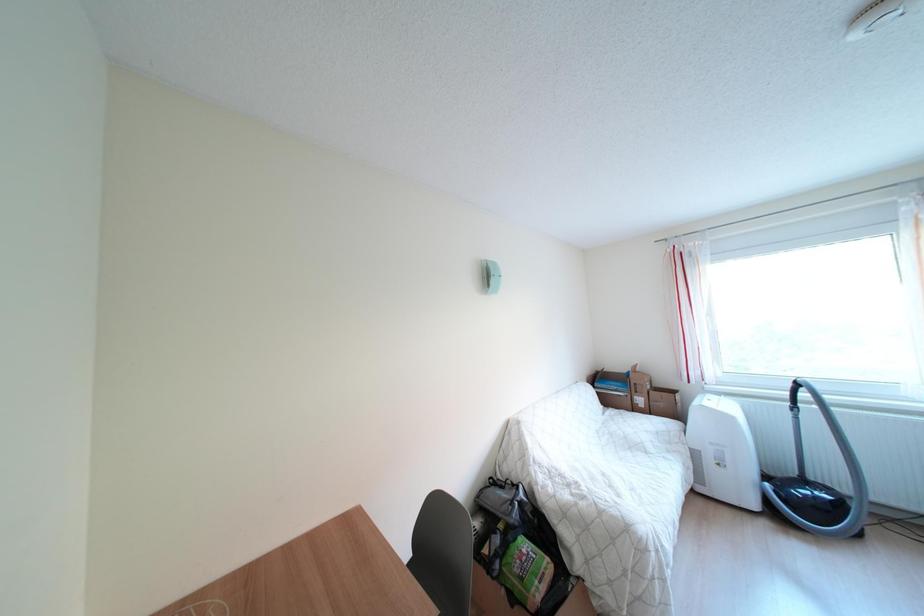
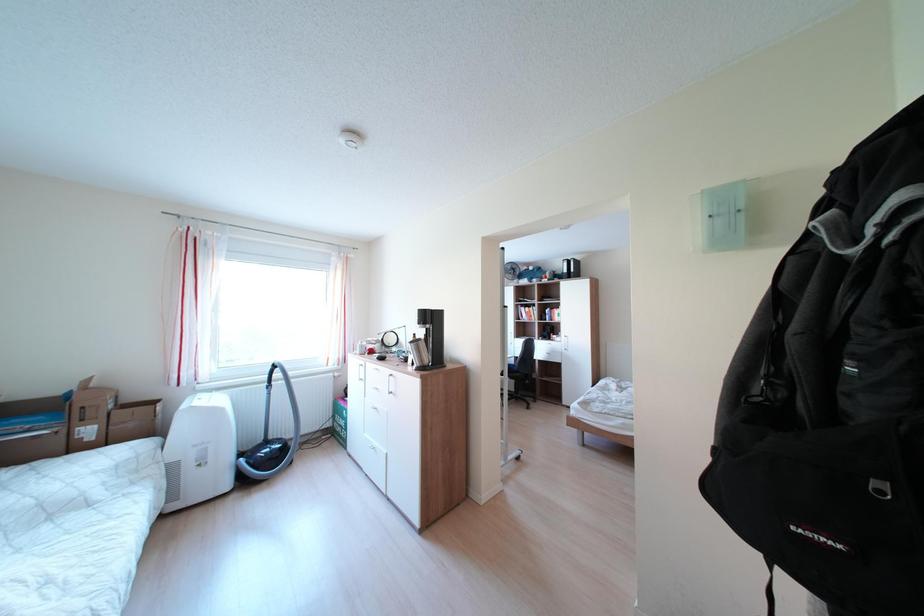
Question: How did the camera likely rotate?

Choices:
 (A) Left
 (B) Right
 (C) Up
 (D) Down

Answer: (B)